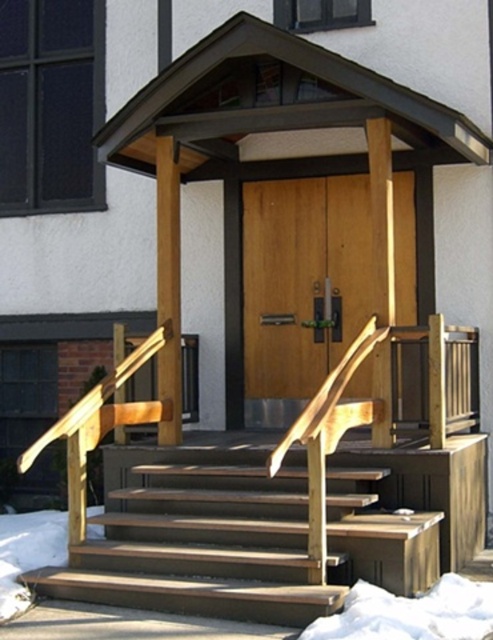
Question: Which object is farther from the camera taking this photo?

Choices:
 (A) brown wood porch at center
 (B) wooden at center
 (C) wooden stairs at center

Answer: (B)

Question: Which is farther from the wooden at center?

Choices:
 (A) brown wood porch at center
 (B) wooden stairs at center

Answer: (B)

Question: Does wooden stairs at center have a larger size compared to wooden at center?

Choices:
 (A) yes
 (B) no

Answer: (A)

Question: Is brown wood porch at center smaller than wooden stairs at center?

Choices:
 (A) no
 (B) yes

Answer: (A)

Question: Is brown wood porch at center behind wooden stairs at center?

Choices:
 (A) no
 (B) yes

Answer: (B)

Question: Which object is positioned farthest from the wooden at center?

Choices:
 (A) wooden stairs at center
 (B) brown wood porch at center

Answer: (A)